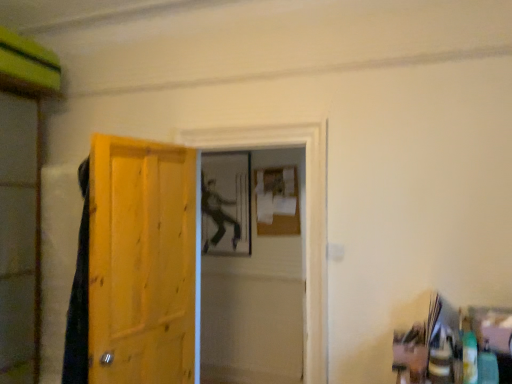
Question: Is matte wooden screen door at center, which is the 1th screen door from right to left, at the left side of matte black figure at center?

Choices:
 (A) yes
 (B) no

Answer: (B)

Question: Is the depth of matte wooden screen door at center, which is the 1th screen door from right to left, greater than that of matte black figure at center?

Choices:
 (A) no
 (B) yes

Answer: (A)

Question: Considering the relative sizes of matte wooden screen door at center, marked as the second screen door in a left-to-right arrangement, and matte black figure at center in the image provided, is matte wooden screen door at center, marked as the second screen door in a left-to-right arrangement, wider than matte black figure at center?

Choices:
 (A) yes
 (B) no

Answer: (A)

Question: Does matte wooden screen door at center, marked as the second screen door in a left-to-right arrangement, turn towards matte black figure at center?

Choices:
 (A) yes
 (B) no

Answer: (B)

Question: From a real-world perspective, is matte wooden screen door at center, marked as the second screen door in a left-to-right arrangement, physically below matte black figure at center?

Choices:
 (A) no
 (B) yes

Answer: (B)

Question: In the image, is matte wooden screen door at center, marked as the second screen door in a left-to-right arrangement, on the left side or the right side of transparent plastic screen door at left, placed as the 2th screen door when sorted from right to left?

Choices:
 (A) left
 (B) right

Answer: (B)

Question: From a real-world perspective, is matte wooden screen door at center, which is the 1th screen door from right to left, above or below transparent plastic screen door at left, placed as the 2th screen door when sorted from right to left?

Choices:
 (A) above
 (B) below

Answer: (B)

Question: Considering the positions of matte wooden screen door at center, marked as the second screen door in a left-to-right arrangement, and transparent plastic screen door at left, placed as the 2th screen door when sorted from right to left, in the image, is matte wooden screen door at center, marked as the second screen door in a left-to-right arrangement, taller or shorter than transparent plastic screen door at left, placed as the 2th screen door when sorted from right to left,?

Choices:
 (A) short
 (B) tall

Answer: (A)

Question: Would you say matte wooden screen door at center, marked as the second screen door in a left-to-right arrangement, is inside or outside transparent plastic screen door at left, positioned as the 1th screen door in left-to-right order?

Choices:
 (A) outside
 (B) inside

Answer: (A)

Question: Is matte black figure at center wider or thinner than matte wooden screen door at center, which is the 1th screen door from right to left?

Choices:
 (A) wide
 (B) thin

Answer: (B)

Question: Is matte black figure at center to the left or to the right of matte wooden screen door at center, marked as the second screen door in a left-to-right arrangement, in the image?

Choices:
 (A) right
 (B) left

Answer: (B)

Question: Which is correct: matte black figure at center is inside matte wooden screen door at center, which is the 1th screen door from right to left, or outside of it?

Choices:
 (A) outside
 (B) inside

Answer: (A)

Question: From the image's perspective, is matte black figure at center located above or below matte wooden screen door at center, which is the 1th screen door from right to left?

Choices:
 (A) below
 (B) above

Answer: (B)

Question: In terms of size, does wooden door at left appear bigger or smaller than transparent plastic screen door at left, positioned as the 1th screen door in left-to-right order?

Choices:
 (A) small
 (B) big

Answer: (A)

Question: From the image's perspective, is wooden door at left above or below transparent plastic screen door at left, placed as the 2th screen door when sorted from right to left?

Choices:
 (A) below
 (B) above

Answer: (A)